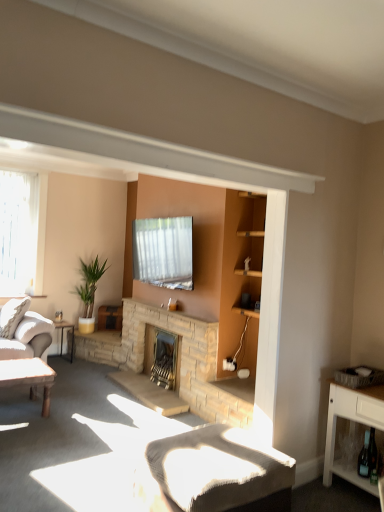
Question: Can you confirm if clear glass window at left is shorter than metallic silver table at left, arranged as the second table when viewed from the front?

Choices:
 (A) no
 (B) yes

Answer: (A)

Question: Is clear glass window at left far away from metallic silver table at left, arranged as the second table when viewed from the front?

Choices:
 (A) no
 (B) yes

Answer: (B)

Question: Is clear glass window at left outside of metallic silver table at left, arranged as the second table when viewed from the front?

Choices:
 (A) no
 (B) yes

Answer: (B)

Question: Is clear glass window at left wider than metallic silver table at left, arranged as the second table when viewed from the front?

Choices:
 (A) yes
 (B) no

Answer: (B)

Question: Can you confirm if clear glass window at left is thinner than metallic silver table at left, marked as the 1th table in a back-to-front arrangement?

Choices:
 (A) no
 (B) yes

Answer: (B)

Question: Would you say green glass wine bottle at lower right is to the left or to the right of white wood cabinet at lower right in the picture?

Choices:
 (A) left
 (B) right

Answer: (A)

Question: In terms of height, does green glass wine bottle at lower right look taller or shorter compared to white wood cabinet at lower right?

Choices:
 (A) tall
 (B) short

Answer: (B)

Question: From a real-world perspective, is green glass wine bottle at lower right physically located above or below white wood cabinet at lower right?

Choices:
 (A) above
 (B) below

Answer: (B)

Question: Do you think green glass wine bottle at lower right is within white wood cabinet at lower right, or outside of it?

Choices:
 (A) outside
 (B) inside

Answer: (B)

Question: From the image's perspective, is stone fireplace at center, which is the first fireplace in back-to-front order, above or below white textured cushion at lower center?

Choices:
 (A) below
 (B) above

Answer: (B)

Question: Considering the relative positions of stone fireplace at center, which is the first fireplace in back-to-front order, and white textured cushion at lower center in the image provided, is stone fireplace at center, which is the first fireplace in back-to-front order, to the left or to the right of white textured cushion at lower center?

Choices:
 (A) left
 (B) right

Answer: (A)

Question: In terms of height, does stone fireplace at center, which is the first fireplace in back-to-front order, look taller or shorter compared to white textured cushion at lower center?

Choices:
 (A) short
 (B) tall

Answer: (B)

Question: From a real-world perspective, is stone fireplace at center, which is the first fireplace in back-to-front order, positioned above or below white textured cushion at lower center?

Choices:
 (A) below
 (B) above

Answer: (B)

Question: In terms of size, does white wood cabinet at lower right appear bigger or smaller than metallic silver table at left, marked as the 1th table in a back-to-front arrangement?

Choices:
 (A) big
 (B) small

Answer: (A)

Question: Looking at their shapes, would you say white wood cabinet at lower right is wider or thinner than metallic silver table at left, marked as the 1th table in a back-to-front arrangement?

Choices:
 (A) thin
 (B) wide

Answer: (A)